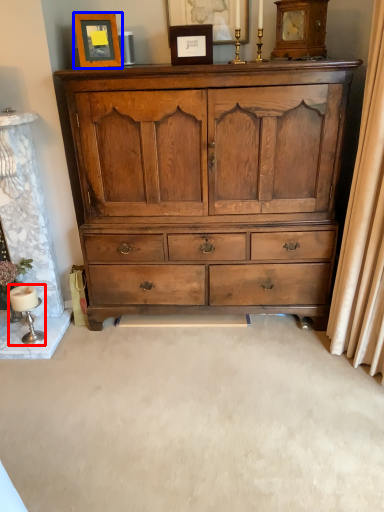
Question: Which point is closer to the camera, table lamp (highlighted by a red box) or picture frame (highlighted by a blue box)?

Choices:
 (A) table lamp
 (B) picture frame

Answer: (B)